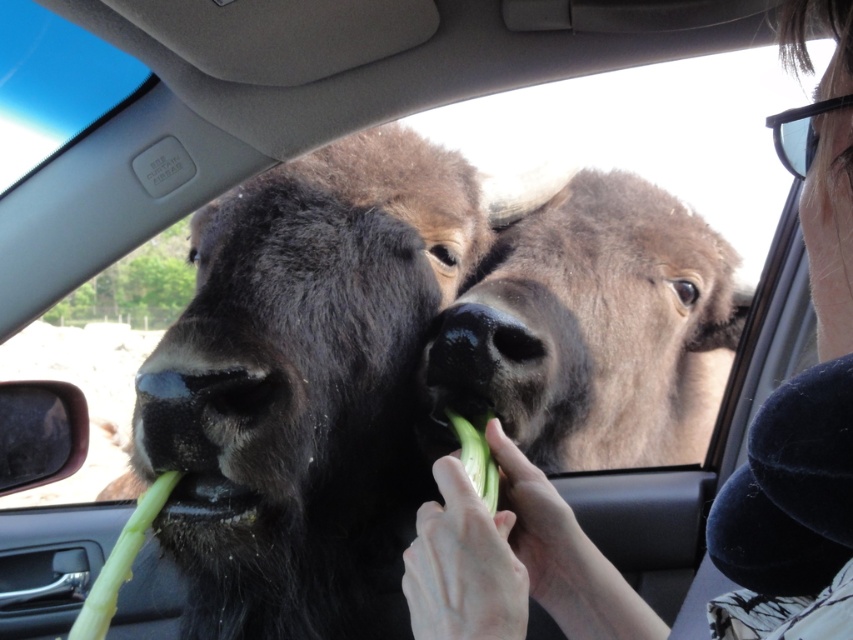
Question: Considering the real-world distances, which object is farthest from the green smooth celery at lower left?

Choices:
 (A) black smooth nose at center
 (B) brown fuzzy yak at center
 (C) black fur yak at center

Answer: (B)

Question: Which is nearer to the brown fuzzy yak at center?

Choices:
 (A) black smooth nose at center
 (B) black fur yak at center

Answer: (B)

Question: Which object is farther from the camera taking this photo?

Choices:
 (A) black smooth nose at center
 (B) green smooth celery at lower left
 (C) brown fuzzy yak at center
 (D) black fur yak at center

Answer: (C)

Question: Can you confirm if brown fuzzy yak at center is positioned above green smooth celery at lower left?

Choices:
 (A) no
 (B) yes

Answer: (B)

Question: Does black fur yak at center appear on the left side of brown fuzzy yak at center?

Choices:
 (A) no
 (B) yes

Answer: (B)

Question: Does black fur yak at center have a greater width compared to brown fuzzy yak at center?

Choices:
 (A) yes
 (B) no

Answer: (B)